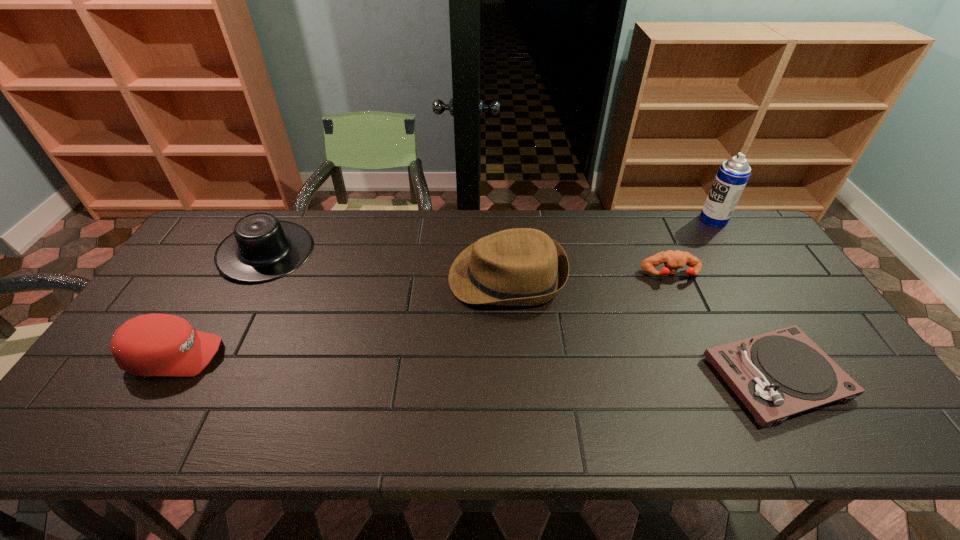
Identify which object is located as the nearest to the fedora. Please provide its 2D coordinates. Your answer should be formatted as a tuple, i.e. [(x, y)], where the tuple contains the x and y coordinates of a point satisfying the conditions above.

[(673, 260)]

Where is `object that is the fourth closest to the third object from left to right`? The width and height of the screenshot is (960, 540). object that is the fourth closest to the third object from left to right is located at coordinates (733, 174).

Locate an element on the screen. The width and height of the screenshot is (960, 540). free spot that satisfies the following two spatial constraints: 1. on the label side of the aerosol can; 2. with the gloves of the puncher facing forward is located at coordinates (748, 274).

At what (x,y) coordinates should I click in order to perform the action: click on vacant space that satisfies the following two spatial constraints: 1. on the back side of the phonograph_record; 2. on the front-facing side of the cap. Please return your answer as a coordinate pair (x, y). The image size is (960, 540). Looking at the image, I should click on (764, 355).

Where is `vacant point that satisfies the following two spatial constraints: 1. with the gloves of the phonograph_record facing forward; 2. on the right side of the puncher`? The height and width of the screenshot is (540, 960). vacant point that satisfies the following two spatial constraints: 1. with the gloves of the phonograph_record facing forward; 2. on the right side of the puncher is located at coordinates (717, 377).

Identify the location of free spot that satisfies the following two spatial constraints: 1. with the gloves of the puncher facing forward; 2. on the front-facing side of the fourth object from right to left. The width and height of the screenshot is (960, 540). (672, 277).